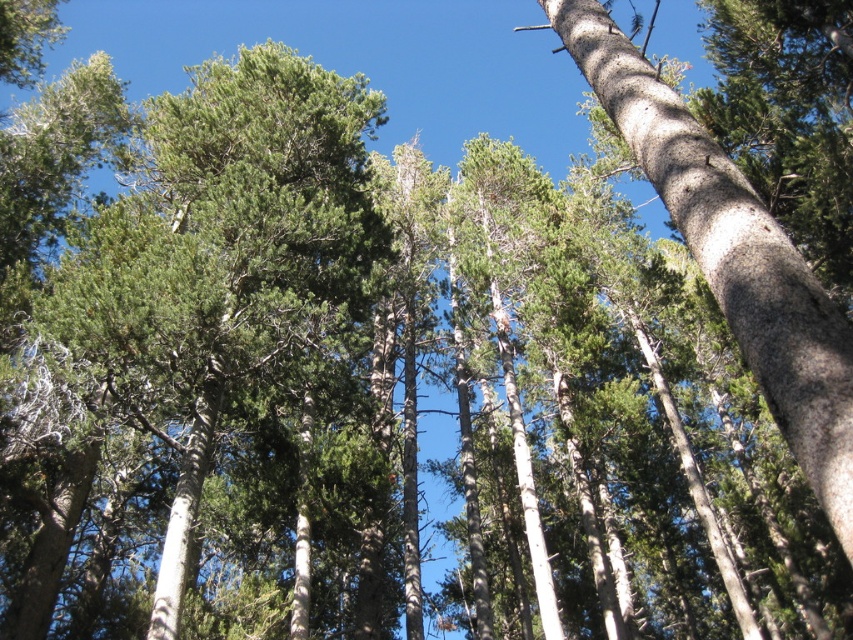
Based on the scene description, if you were standing in the forest looking up, which direction would the green needle leaves at point (231, 275) be located relative to you?

The point (231, 275) marks green needle leaves at upper left, so they would be located to the upper left direction from your viewpoint.